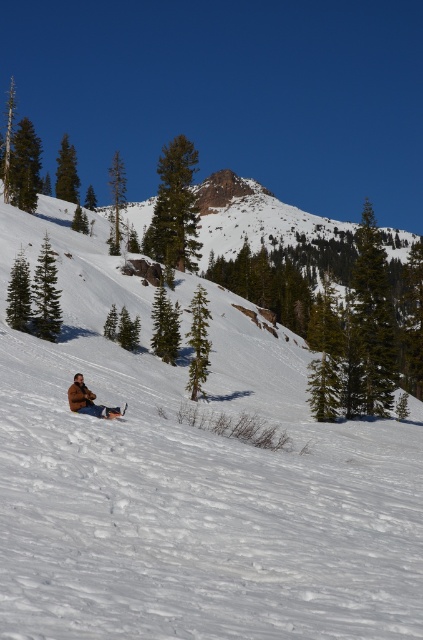
Is point (255, 392) farther from viewer compared to point (91, 392)?

Yes, it is behind point (91, 392).

At what (x,y) coordinates should I click in order to perform the action: click on white powdery snow at center. Please return your answer as a coordinate pair (x, y). The height and width of the screenshot is (640, 423). Looking at the image, I should click on (189, 477).

Image resolution: width=423 pixels, height=640 pixels. What are the coordinates of `white powdery snow at center` in the screenshot? It's located at (189, 477).

Does brown fuzzy jacket at lower left have a greater height compared to white plastic snowboard at lower center?

Correct, brown fuzzy jacket at lower left is much taller as white plastic snowboard at lower center.

The width and height of the screenshot is (423, 640). Identify the location of brown fuzzy jacket at lower left. 88,401.

Where is `brown fuzzy jacket at lower left`? brown fuzzy jacket at lower left is located at coordinates (88, 401).

Does white powdery snow at center have a larger size compared to white plastic snowboard at lower center?

Yes.

Is white powdery snow at center closer to camera compared to white plastic snowboard at lower center?

Yes, white powdery snow at center is closer to the viewer.

Is point (2, 595) positioned after point (120, 410)?

No, it is not.

Locate an element on the screen. white powdery snow at center is located at coordinates (189, 477).